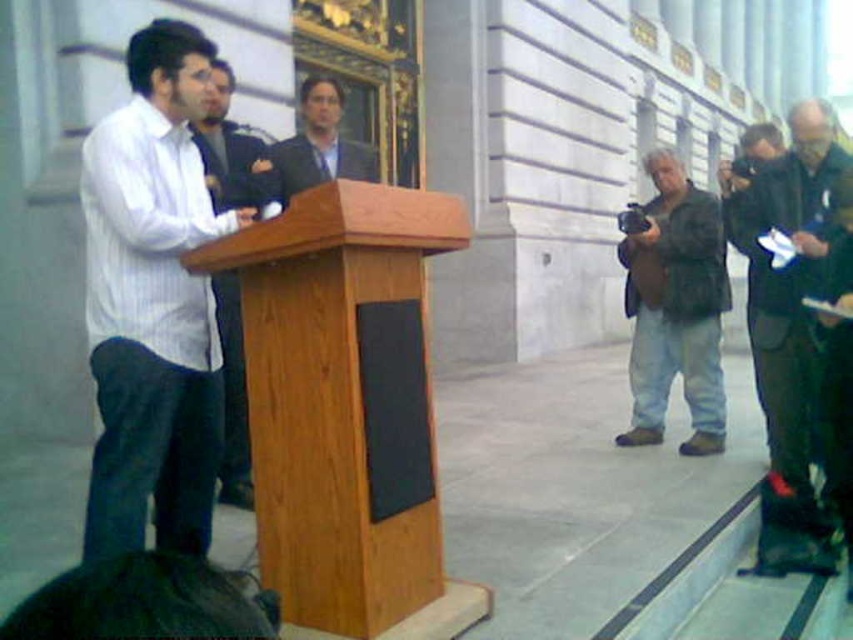
You are standing at the podium and want to check your appearance in the reflection of the large building behind you. Which part of your clothing is most likely reflected at the coordinates point (152, 304)?

The point (152, 304) is on the white striped dress shirt at center, so the reflection at that coordinate would show the white striped dress shirt at center.

You are a photographer positioned at the camera in the scene. You want to take a photo that includes both the man at the podium and the large building in the background. Which of the two points, point (786, 435) or point (705, 301), is closer to your camera position?

Point (786, 435) is closer to the camera than point (705, 301), so it will appear nearer in the photo.